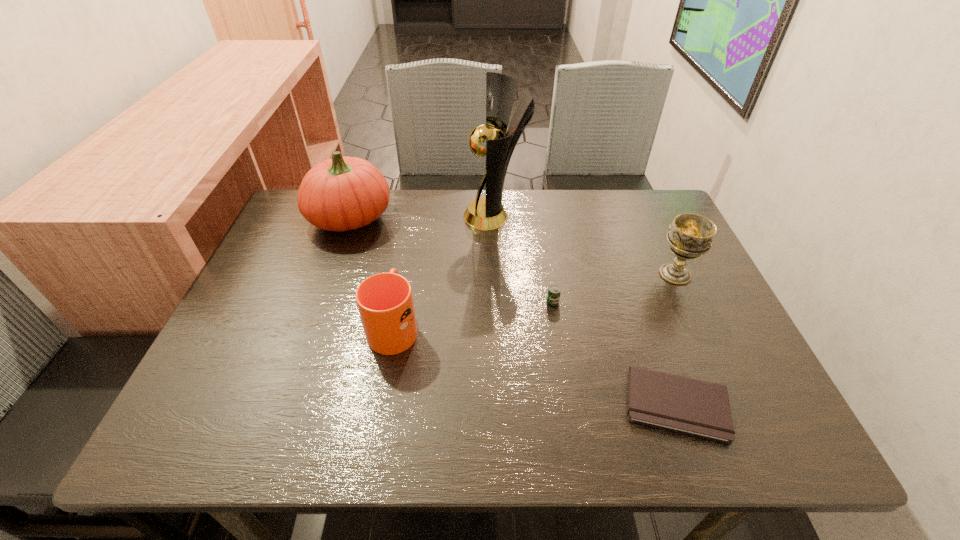
You are a GUI agent. You are given a task and a screenshot of the screen. Output one action in this format:
    pyautogui.click(x=<x>, y=<y>)
    Task: Click on the free space at the near left corner
    The image size is (960, 540).
    Given the screenshot: What is the action you would take?
    pyautogui.click(x=185, y=437)

The height and width of the screenshot is (540, 960). I want to click on free space at the near right corner of the desktop, so click(792, 447).

You are a GUI agent. You are given a task and a screenshot of the screen. Output one action in this format:
    pyautogui.click(x=<x>, y=<y>)
    Task: Click on the unoccupied area between the fifth shortest object and the mug
    The image size is (960, 540).
    Given the screenshot: What is the action you would take?
    pyautogui.click(x=372, y=272)

This screenshot has width=960, height=540. I want to click on vacant space in between the tallest object and the mug, so click(x=444, y=271).

The image size is (960, 540). In order to click on free space between the checkbook and the beer can in this screenshot , I will do `click(615, 353)`.

The width and height of the screenshot is (960, 540). I want to click on free spot between the second object from left to right and the pumpkin, so click(372, 272).

Identify the location of vacant area that lies between the third farthest object and the shortest object. This screenshot has height=540, width=960. (676, 339).

Where is `free spot between the beer can and the checkbook`? This screenshot has width=960, height=540. free spot between the beer can and the checkbook is located at coordinates (615, 353).

Find the location of a particular element. empty space that is in between the third farthest object and the tallest object is located at coordinates (585, 245).

Where is `unoccupied area between the shortest object and the tallest object`? unoccupied area between the shortest object and the tallest object is located at coordinates (586, 310).